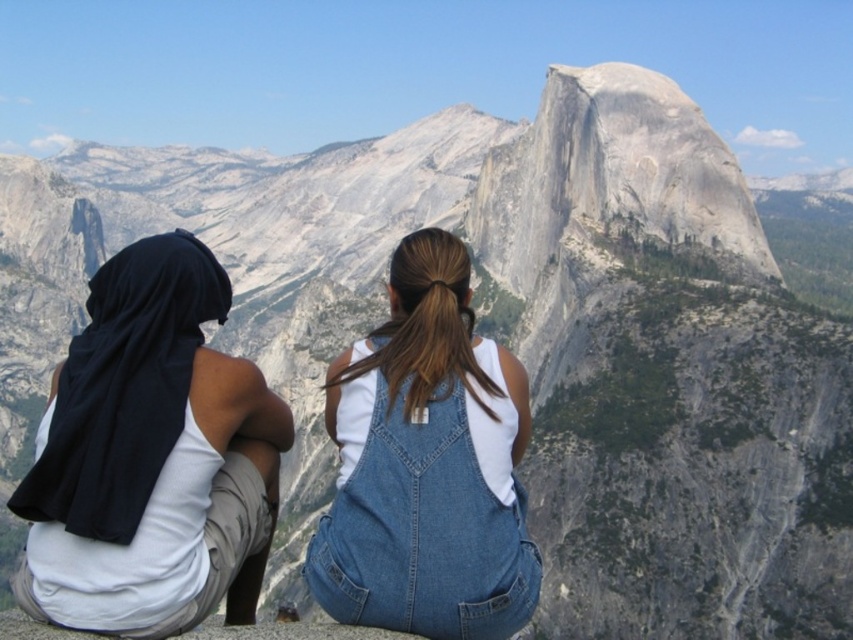
Does white cotton tank top at left have a lesser height compared to denim overalls at center?

Yes.

Between point (41, 499) and point (509, 531), which one is positioned behind?

Positioned behind is point (509, 531).

Find the location of a particular element. The width and height of the screenshot is (853, 640). white cotton tank top at left is located at coordinates (151, 458).